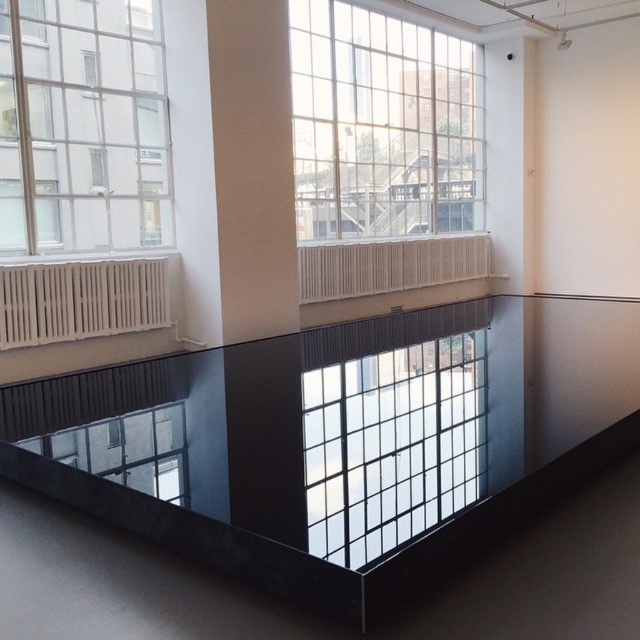
From the picture: Does clear glass window at upper left have a lesser height compared to transparent glass window at center?

Incorrect, clear glass window at upper left's height does not fall short of transparent glass window at center's.

Who is positioned more to the left, clear glass window at upper left or transparent glass window at center?

clear glass window at upper left

What do you see at coordinates (83, 125) in the screenshot? I see `clear glass window at upper left` at bounding box center [83, 125].

Find the location of a particular element. Image resolution: width=640 pixels, height=640 pixels. clear glass window at upper left is located at coordinates (83, 125).

Who is positioned more to the right, transparent glass table at center or clear glass window at upper center?

clear glass window at upper center

From the picture: Who is higher up, transparent glass table at center or clear glass window at upper center?

clear glass window at upper center is higher up.

Who is more forward, (513, 632) or (454, 228)?

Point (513, 632) is more forward.

This screenshot has width=640, height=640. In order to click on transparent glass table at center in this screenshot , I will do `click(305, 509)`.

Is clear glass window at upper left above transparent glass window at lower left?

Yes.

Between clear glass window at upper left and transparent glass window at lower left, which one is positioned lower?

Positioned lower is transparent glass window at lower left.

Measure the distance between point (116, 156) and camera.

The distance of point (116, 156) from camera is 21.19 feet.

At what (x,y) coordinates should I click in order to perform the action: click on clear glass window at upper left. Please return your answer as a coordinate pair (x, y). Looking at the image, I should click on (83, 125).